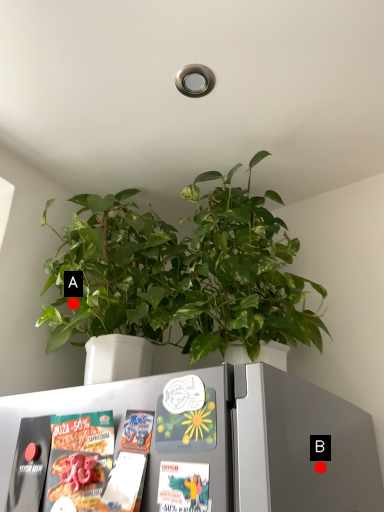
Question: Two points are circled on the image, labeled by A and B beside each circle. Which point is farther from the camera taking this photo?

Choices:
 (A) A is further
 (B) B is further

Answer: (A)